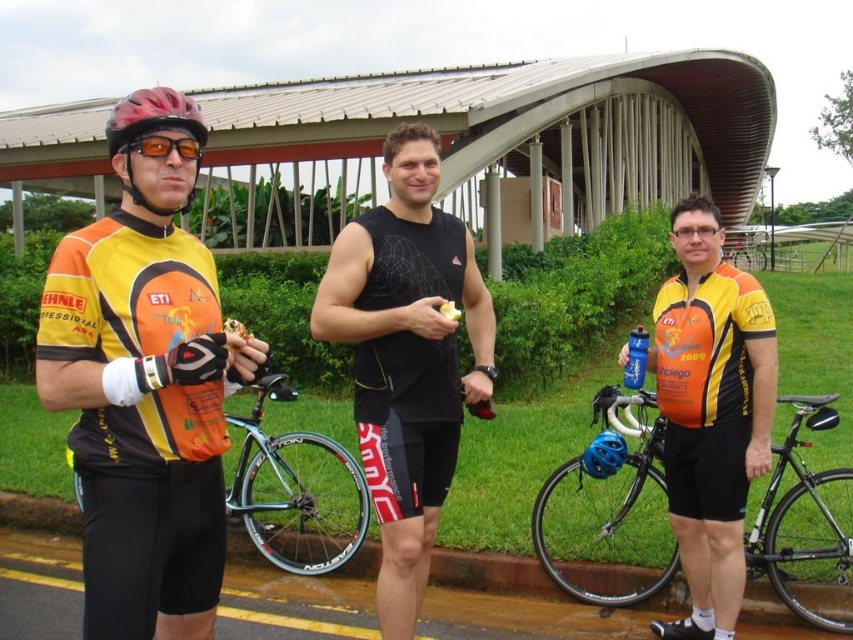
You are standing at the starting line of a cycling race and see the matte black cycling jersey at left and the black matte tank top at center. If you need to hand a water bottle to both riders, which one would you approach first if you want to give the water bottle to the rider closer to you?

The matte black cycling jersey at left is closer to you at 5.83 feet away from the black matte tank top at center, so you should approach the matte black cycling jersey at left first.

You are a photographer trying to capture a photo of the shiny silver bicycle at center. There is a person wearing a matte black cycling jersey at left blocking your view. Can you move to the right to get a clear shot of the bicycle?

The matte black cycling jersey at left is to the left of the shiny silver bicycle at center. Moving to the right of the matte black cycling jersey at left should allow you to see the shiny silver bicycle at center without obstruction.